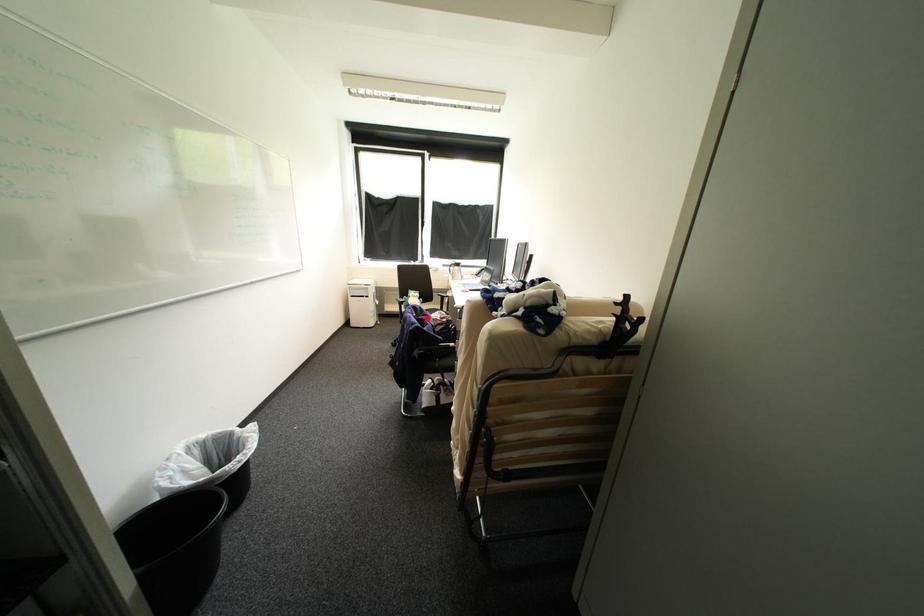
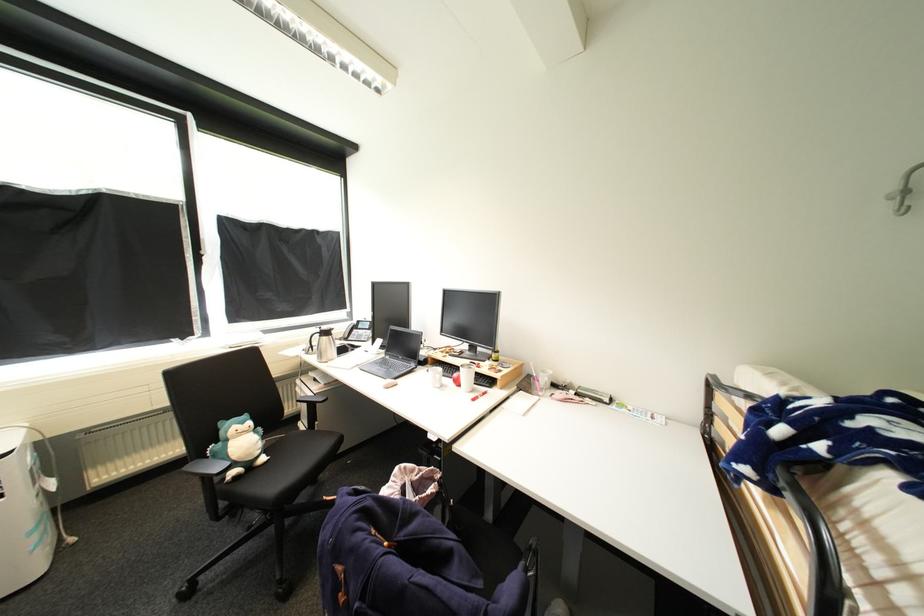
Where in the second image is the point corresponding to the highlighted location from the first image?

(408, 537)